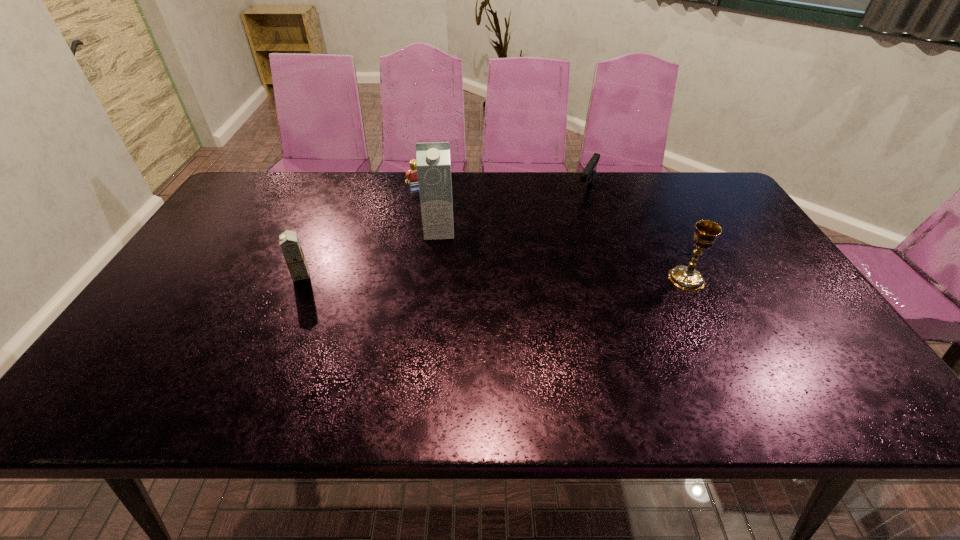
The image size is (960, 540). Find the location of `vacant spot on the desktop that is between the third tallest object and the rightmost object and is positioned on the front-facing side of the second object from right to left`. vacant spot on the desktop that is between the third tallest object and the rightmost object and is positioned on the front-facing side of the second object from right to left is located at coordinates (535, 277).

Where is `vacant spot on the desktop that is between the leftmost object and the rightmost object and is positioned on the front-facing side of the Lego`? The height and width of the screenshot is (540, 960). vacant spot on the desktop that is between the leftmost object and the rightmost object and is positioned on the front-facing side of the Lego is located at coordinates (451, 276).

Locate an element on the screen. This screenshot has height=540, width=960. vacant space on the desktop that is between the leftmost object and the chalice and is positioned on the front label of the third object from right to left is located at coordinates (439, 276).